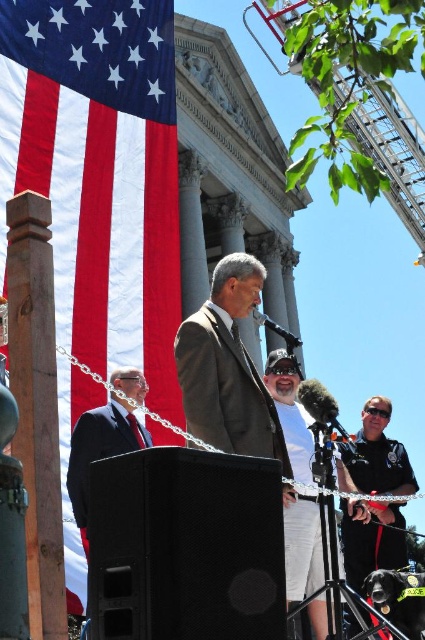
Question: Can you confirm if dark gray suit at center is bigger than white cotton shirt at center?

Choices:
 (A) no
 (B) yes

Answer: (B)

Question: Is dark gray suit at center wider than white cotton shirt at center?

Choices:
 (A) no
 (B) yes

Answer: (B)

Question: Is the position of black matte speaker at lower center more distant than that of dark gray suit at center?

Choices:
 (A) no
 (B) yes

Answer: (A)

Question: Among these points, which one is nearest to the camera?

Choices:
 (A) (61, 48)
 (B) (289, 406)
 (C) (346, 502)

Answer: (A)

Question: Which point appears closest to the camera in this image?

Choices:
 (A) (57, 160)
 (B) (291, 428)
 (C) (396, 529)

Answer: (A)

Question: Which object is farther from the camera taking this photo?

Choices:
 (A) white cotton shirt at center
 (B) dark gray suit at center
 (C) black matte speaker at lower center
 (D) red fabric flag at left

Answer: (B)